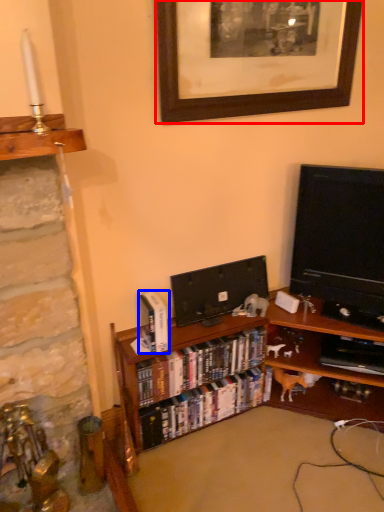
Question: Which of the following is the farthest to the observer, picture frame (highlighted by a red box) or book (highlighted by a blue box)?

Choices:
 (A) picture frame
 (B) book

Answer: (B)